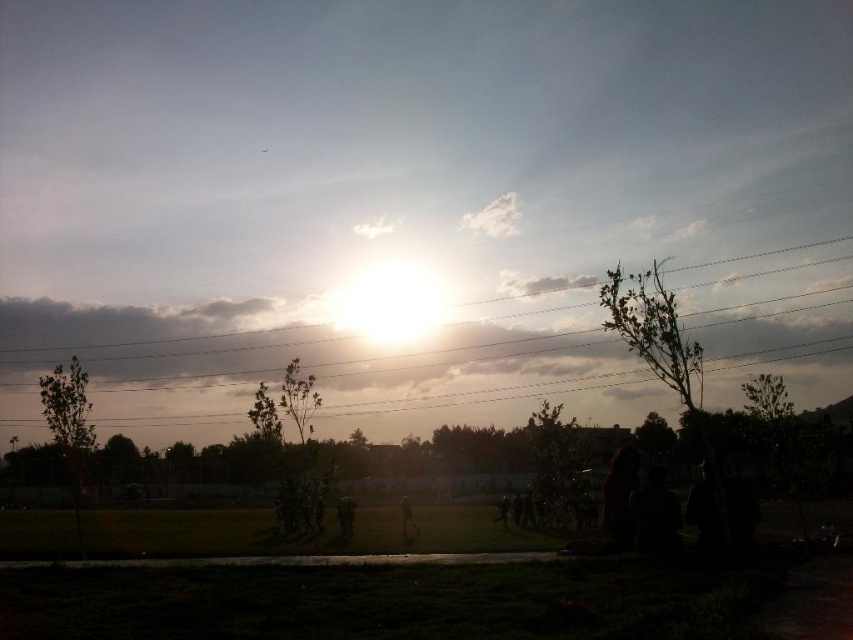
Question: Does metallic wires at upper center have a greater width compared to green leafy tree at center?

Choices:
 (A) yes
 (B) no

Answer: (A)

Question: Is metallic wires at upper center wider than green leafy tree at center?

Choices:
 (A) yes
 (B) no

Answer: (A)

Question: Does metallic wires at upper center have a smaller size compared to green leafy tree at center?

Choices:
 (A) yes
 (B) no

Answer: (B)